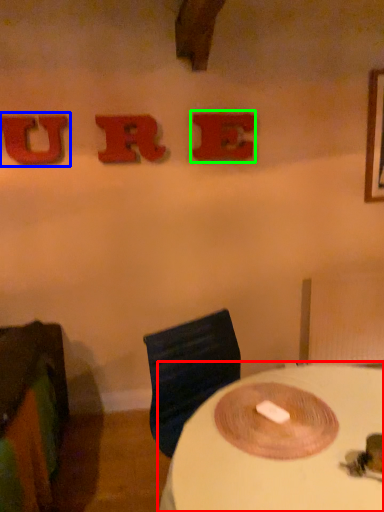
Question: Which object is positioned closest to table (highlighted by a red box)? Select from alphabet (highlighted by a blue box) and alphabet (highlighted by a green box).

Choices:
 (A) alphabet
 (B) alphabet

Answer: (B)